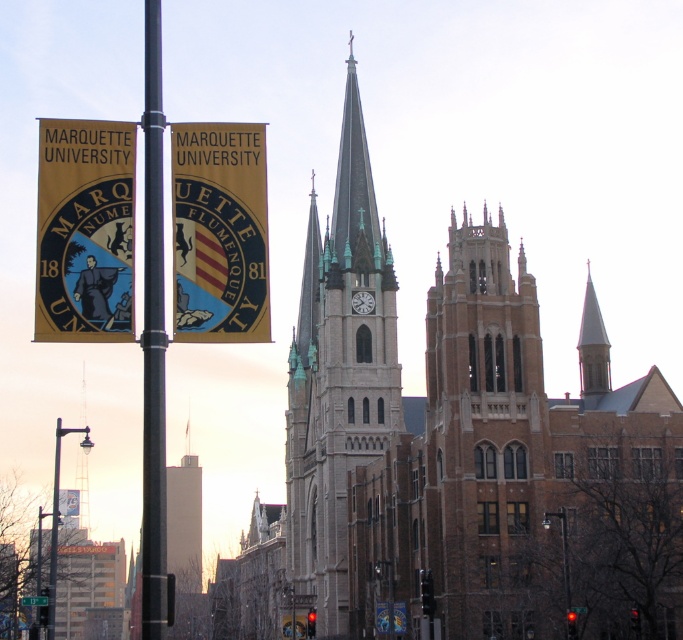
Question: Which point appears farthest from the camera in this image?

Choices:
 (A) (475, 394)
 (B) (53, 620)
 (C) (583, 320)
 (D) (55, 476)

Answer: (D)

Question: Which of the following is the closest to the observer?

Choices:
 (A) (55, 515)
 (B) (48, 637)
 (C) (350, 417)

Answer: (B)

Question: Which object is positioned closest to the smooth gray steeple at upper right?

Choices:
 (A) black metal pole at center
 (B) white stone tower at center
 (C) metallic streetlight at lower left

Answer: (B)

Question: Does white stone tower at center appear on the left side of black metal pole at center?

Choices:
 (A) yes
 (B) no

Answer: (B)

Question: Is the position of brown brick tower at center more distant than that of metallic pole at lower left?

Choices:
 (A) yes
 (B) no

Answer: (A)

Question: Can you confirm if light gray stone church at center is positioned to the left of green plastic street sign at center?

Choices:
 (A) no
 (B) yes

Answer: (A)